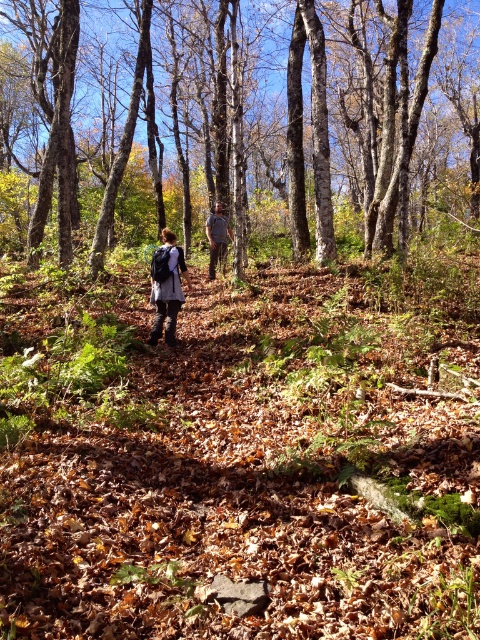
Question: Which of the following is the closest to the observer?

Choices:
 (A) brown smooth tree at center
 (B) matte gray coat at center
 (C) dark brown leather jacket at center
 (D) matte gray jacket at center

Answer: (B)

Question: Which point is closer to the camera taking this photo?

Choices:
 (A) (383, 145)
 (B) (218, 260)
 (C) (157, 304)
 (D) (179, 298)

Answer: (D)

Question: Is brown smooth tree at center bigger than matte gray jacket at center?

Choices:
 (A) yes
 (B) no

Answer: (A)

Question: Which point appears closest to the camera in this image?

Choices:
 (A) (219, 240)
 (B) (225, 230)
 (C) (242, 157)

Answer: (C)

Question: Can you confirm if brown smooth tree at center is positioned below matte gray jacket at center?

Choices:
 (A) yes
 (B) no

Answer: (B)

Question: Does brown smooth tree at center have a greater width compared to matte gray jacket at center?

Choices:
 (A) no
 (B) yes

Answer: (B)